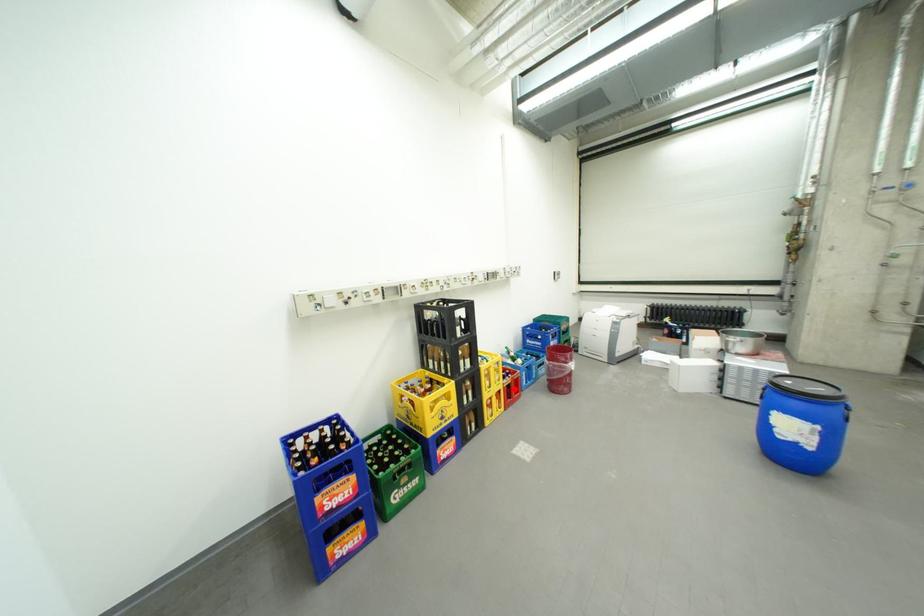
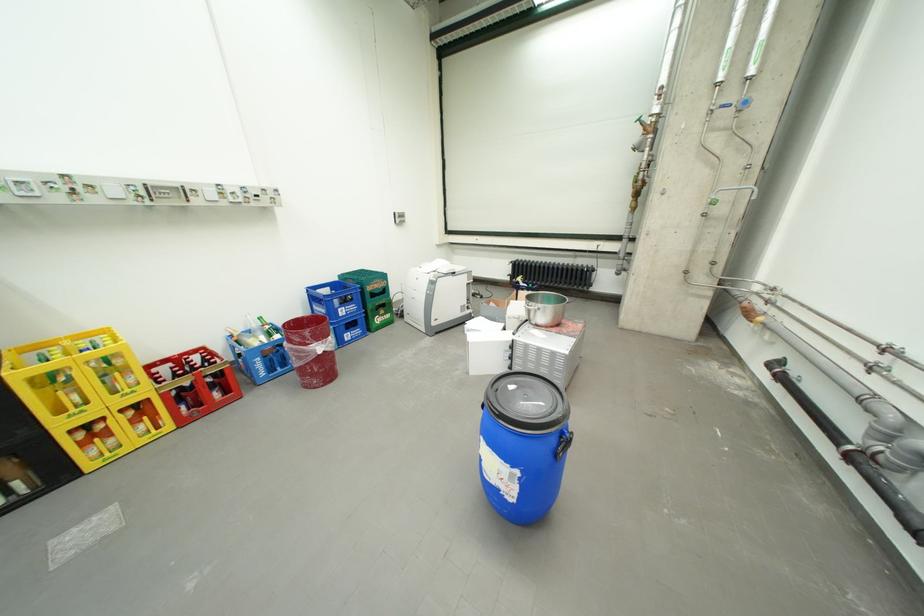
Where in the second image is the point corresponding to the highlighted location from the first image?

(172, 397)